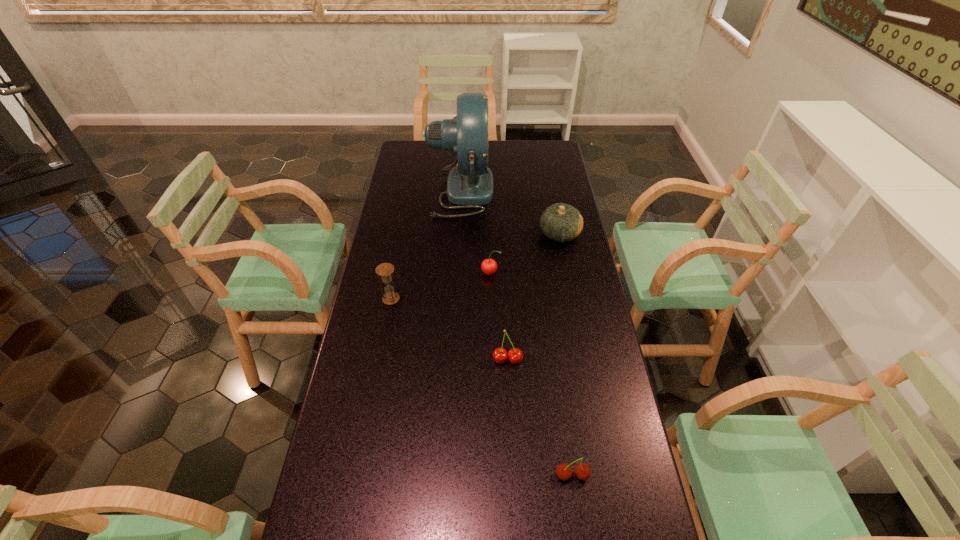
This screenshot has height=540, width=960. I want to click on the farthest object, so click(470, 183).

This screenshot has height=540, width=960. In order to click on fan in this screenshot , I will do `click(470, 183)`.

This screenshot has width=960, height=540. In order to click on the leftmost object in this screenshot , I will do `click(385, 270)`.

At what (x,y) coordinates should I click in order to perform the action: click on the third nearest object. Please return your answer as a coordinate pair (x, y). This screenshot has height=540, width=960. Looking at the image, I should click on (385, 270).

Identify the location of the fifth nearest object. (561, 222).

Where is `the farthest cherry`? This screenshot has height=540, width=960. the farthest cherry is located at coordinates (489, 266).

Locate an element on the screen. The image size is (960, 540). the second nearest cherry is located at coordinates (515, 355).

Where is `the nearest cherry`? The height and width of the screenshot is (540, 960). the nearest cherry is located at coordinates (564, 472).

Locate an element on the screen. The width and height of the screenshot is (960, 540). the rightmost cherry is located at coordinates (564, 472).

Find the location of a particular element. free space located in front of the fan to blow air is located at coordinates (561, 191).